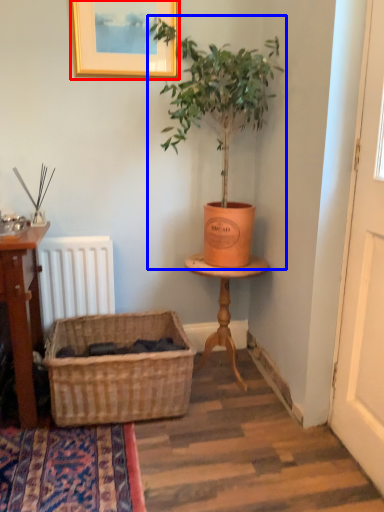
Question: Which object is closer to the camera taking this photo, picture frame (highlighted by a red box) or houseplant (highlighted by a blue box)?

Choices:
 (A) picture frame
 (B) houseplant

Answer: (B)